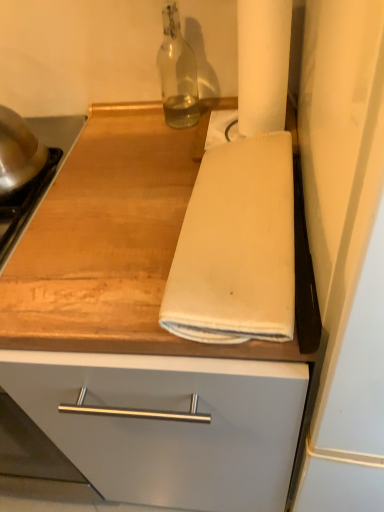
Question: Can you see wooden at center touching transparent glass bottle at upper center?

Choices:
 (A) yes
 (B) no

Answer: (B)

Question: Would you say wooden at center is outside transparent glass bottle at upper center?

Choices:
 (A) no
 (B) yes

Answer: (B)

Question: From a real-world perspective, is wooden at center beneath transparent glass bottle at upper center?

Choices:
 (A) no
 (B) yes

Answer: (B)

Question: Considering the relative positions of wooden at center and transparent glass bottle at upper center in the image provided, is wooden at center in front of transparent glass bottle at upper center?

Choices:
 (A) yes
 (B) no

Answer: (A)

Question: Could you tell me if wooden at center is turned towards transparent glass bottle at upper center?

Choices:
 (A) yes
 (B) no

Answer: (B)

Question: Is wooden at center at the right side of transparent glass bottle at upper center?

Choices:
 (A) no
 (B) yes

Answer: (B)

Question: From a real-world perspective, is wooden at center on top of white matte paper towel at upper right?

Choices:
 (A) no
 (B) yes

Answer: (A)

Question: Can you confirm if wooden at center is smaller than white matte paper towel at upper right?

Choices:
 (A) no
 (B) yes

Answer: (A)

Question: Is wooden at center oriented towards white matte paper towel at upper right?

Choices:
 (A) yes
 (B) no

Answer: (B)

Question: Considering the relative sizes of wooden at center and white matte paper towel at upper right in the image provided, is wooden at center shorter than white matte paper towel at upper right?

Choices:
 (A) yes
 (B) no

Answer: (B)

Question: Considering the relative positions of wooden at center and white matte paper towel at upper right in the image provided, is wooden at center to the right of white matte paper towel at upper right from the viewer's perspective?

Choices:
 (A) no
 (B) yes

Answer: (A)

Question: Is wooden at center at the left side of white matte paper towel at upper right?

Choices:
 (A) no
 (B) yes

Answer: (B)

Question: Is white cotton towel at center beside white matte paper towel at upper right?

Choices:
 (A) yes
 (B) no

Answer: (B)